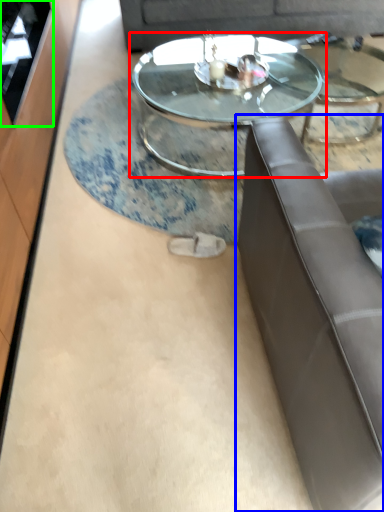
Question: Based on their relative distances, which object is nearer to coffee table (highlighted by a red box)? Choose from studio couch (highlighted by a blue box) and glass door (highlighted by a green box).

Choices:
 (A) studio couch
 (B) glass door

Answer: (B)